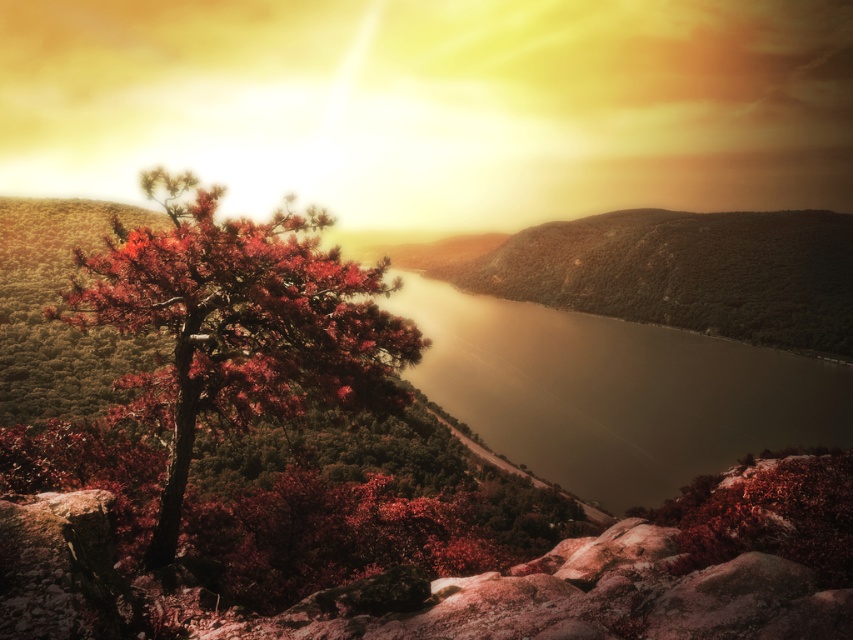
You are standing in the landscape scene and want to walk from point [509,444] to point [175,385]. Which direction should you move relative to your current position?

You should move towards the lower left direction because point [175,385] is located lower and to the left compared to point [509,444].